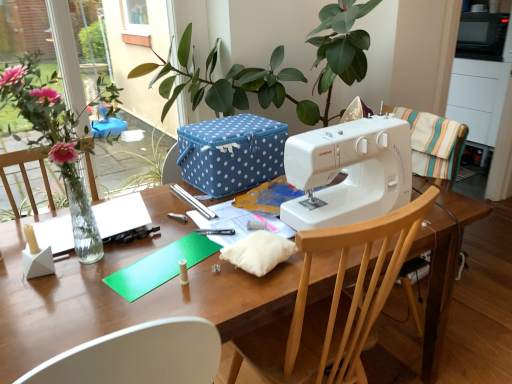
Locate an element on the screen. free spot above wooden table at center (from a real-world perspective) is located at coordinates (169, 245).